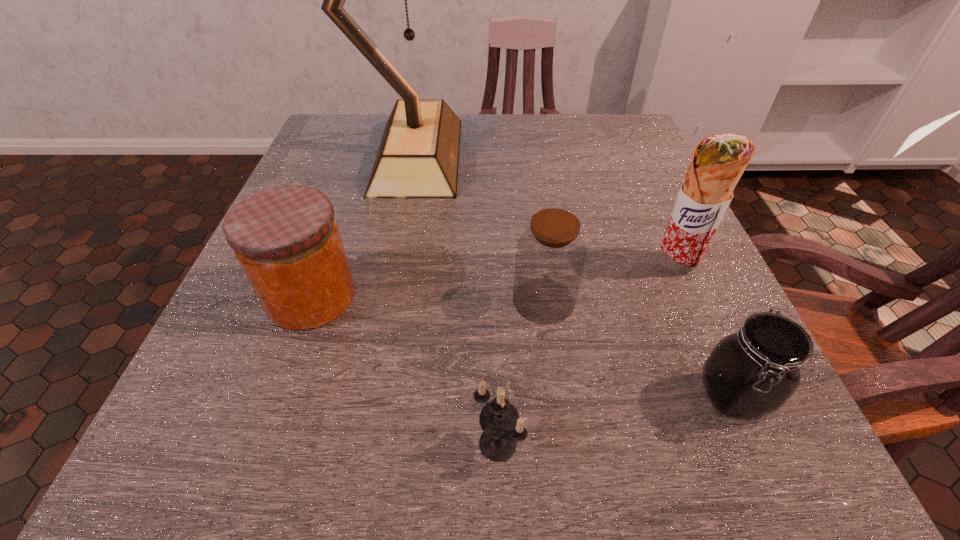
Identify the location of free space between the table lamp and the candle holder. (458, 299).

You are a GUI agent. You are given a task and a screenshot of the screen. Output one action in this format:
    pyautogui.click(x=<x>, y=<y>)
    Task: Click on the vacant area that lies between the tallest object and the leftmost jar
    This screenshot has width=960, height=540.
    Given the screenshot: What is the action you would take?
    pyautogui.click(x=365, y=226)

The height and width of the screenshot is (540, 960). Find the location of `empty space between the second tallest object and the leftmost jar`. empty space between the second tallest object and the leftmost jar is located at coordinates (493, 280).

Find the location of `vacant area that lies between the shortest jar and the burrito`. vacant area that lies between the shortest jar and the burrito is located at coordinates (704, 330).

Locate an element on the screen. Image resolution: width=960 pixels, height=540 pixels. vacant point located between the third object from right to left and the leftmost jar is located at coordinates (427, 299).

Where is `free area in between the candle holder and the leftmost jar`? This screenshot has width=960, height=540. free area in between the candle holder and the leftmost jar is located at coordinates (404, 370).

Locate an element on the screen. vacant region between the rightmost jar and the fourth object from left to right is located at coordinates (638, 348).

Select which object appears as the second closest to the nearest jar. Please provide its 2D coordinates. Your answer should be formatted as a tuple, i.e. [(x, y)], where the tuple contains the x and y coordinates of a point satisfying the conditions above.

[(718, 162)]

Identify which object is the fifth closest to the candle holder. Please provide its 2D coordinates. Your answer should be formatted as a tuple, i.e. [(x, y)], where the tuple contains the x and y coordinates of a point satisfying the conditions above.

[(418, 157)]

Where is `the closest jar to the shortest jar`? This screenshot has height=540, width=960. the closest jar to the shortest jar is located at coordinates (550, 256).